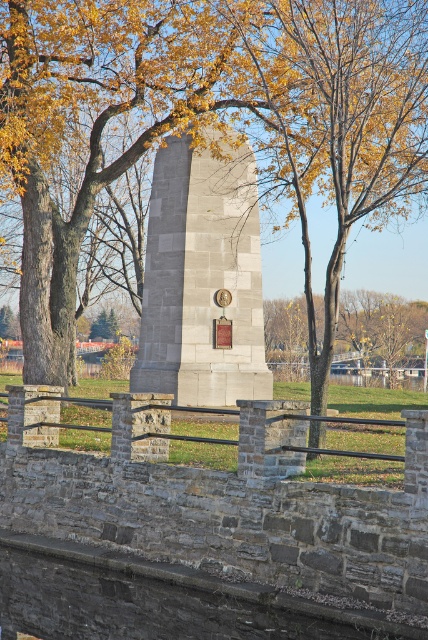
You are standing in front of the monument and want to place a small bouquet of flowers between the gray stone monument at center and the gold metallic clock at center. Based on their positions, which object should you place the bouquet closer to if you want it to be on the left side of the path?

You should place the bouquet closer to the gold metallic clock at center because the gray stone monument at center is to the right of the gold metallic clock at center, so the left side of the path would be near the clock.

You are standing in front of the monument and want to take a photo that includes both the brown leafy tree at center and the gold metallic clock at center. Which object should you focus on first to ensure both are in sharp focus?

Answer: You should focus on the brown leafy tree at center first because it is closer to the viewer than the gold metallic clock at center, so focusing on the closer object will help both be in focus.

You are standing in front of the monument and want to take a photo of the brown leafy tree at center. The camera you have can focus on objects up to 15 meters away. Will the tree be in focus?

The distance between the brown leafy tree at center and the camera is 16.30 meters, which exceeds the camera focus limit of 15 meters. Therefore, the tree will not be in focus.